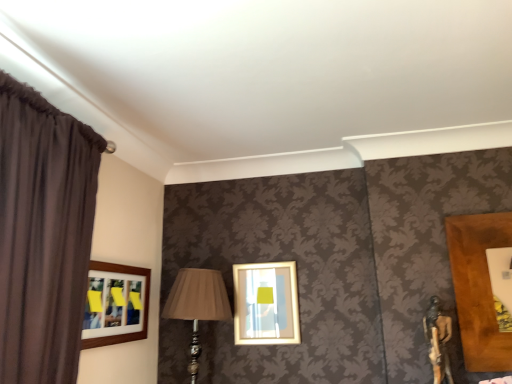
You are a GUI agent. You are given a task and a screenshot of the screen. Output one action in this format:
    pyautogui.click(x=<x>, y=<y>)
    Task: Click on the dark brown fabric curtain at left
    
    Given the screenshot: What is the action you would take?
    pyautogui.click(x=42, y=234)

How much space does wooden-framed picture at left, placed as the second picture frame when sorted from right to left, occupy horizontally?

The width of wooden-framed picture at left, placed as the second picture frame when sorted from right to left, is 1.39 inches.

Locate an element on the screen. wooden-framed picture at left, placed as the second picture frame when sorted from right to left is located at coordinates (115, 304).

Locate an element on the screen. matte gold picture frame at center, which ranks as the 1th picture frame in right-to-left order is located at coordinates (266, 304).

What do you see at coordinates (197, 305) in the screenshot?
I see `matte beige fabric at center` at bounding box center [197, 305].

At what (x,y) coordinates should I click in order to perform the action: click on dark brown fabric curtain at left. Please return your answer as a coordinate pair (x, y). Looking at the image, I should click on (42, 234).

Considering the sizes of objects matte gold picture frame at center, which ranks as the 1th picture frame in right-to-left order, and matte beige fabric at center in the image provided, who is bigger, matte gold picture frame at center, which ranks as the 1th picture frame in right-to-left order, or matte beige fabric at center?

With larger size is matte beige fabric at center.

Does point (294, 299) come closer to viewer compared to point (186, 273)?

That is False.

Is matte gold picture frame at center, arranged as the 2th picture frame when viewed from the left, oriented towards matte beige fabric at center?

No, matte gold picture frame at center, arranged as the 2th picture frame when viewed from the left, is not facing towards matte beige fabric at center.

From the image's perspective, who appears lower, matte gold picture frame at center, arranged as the 2th picture frame when viewed from the left, or matte beige fabric at center?

From the image's view, matte beige fabric at center is below.

Do you think matte beige fabric at center is within matte gold picture frame at center, arranged as the 2th picture frame when viewed from the left, or outside of it?

matte beige fabric at center exists outside the volume of matte gold picture frame at center, arranged as the 2th picture frame when viewed from the left.

Locate an element on the screen. picture frame on the right of matte beige fabric at center is located at coordinates (266, 304).

Measure the distance between matte beige fabric at center and matte gold picture frame at center, arranged as the 2th picture frame when viewed from the left.

matte beige fabric at center is 8.07 inches from matte gold picture frame at center, arranged as the 2th picture frame when viewed from the left.

In order to click on curtain positioned vertically above the wooden-framed picture at left, placed as the second picture frame when sorted from right to left (from a real-world perspective) in this screenshot , I will do `click(42, 234)`.

Does wooden-framed picture at left, placed as the 1th picture frame when sorted from left to right, appear on the left side of dark brown fabric curtain at left?

No, wooden-framed picture at left, placed as the 1th picture frame when sorted from left to right, is not to the left of dark brown fabric curtain at left.

From a real-world perspective, does wooden-framed picture at left, placed as the second picture frame when sorted from right to left, sit lower than dark brown fabric curtain at left?

Yes.

Which is more distant, (118, 319) or (53, 260)?

Point (118, 319)

Considering the sizes of matte beige fabric at center and dark brown fabric curtain at left in the image, is matte beige fabric at center wider or thinner than dark brown fabric curtain at left?

Clearly, matte beige fabric at center has more width compared to dark brown fabric curtain at left.

Would you say matte beige fabric at center is inside or outside dark brown fabric curtain at left?

matte beige fabric at center exists outside the volume of dark brown fabric curtain at left.

The width and height of the screenshot is (512, 384). In order to click on curtain in front of the matte beige fabric at center in this screenshot , I will do `click(42, 234)`.

From a real-world perspective, is dark brown fabric curtain at left physically below matte gold picture frame at center, which ranks as the 1th picture frame in right-to-left order?

Actually, dark brown fabric curtain at left is physically above matte gold picture frame at center, which ranks as the 1th picture frame in right-to-left order, in the real world.

Does point (20, 352) appear closer or farther from the camera than point (283, 320)?

Clearly, point (20, 352) is closer to the camera than point (283, 320).

From the image's perspective, between dark brown fabric curtain at left and matte gold picture frame at center, which ranks as the 1th picture frame in right-to-left order, which one is located above?

dark brown fabric curtain at left.

Considering the sizes of dark brown fabric curtain at left and matte gold picture frame at center, arranged as the 2th picture frame when viewed from the left, in the image, is dark brown fabric curtain at left bigger or smaller than matte gold picture frame at center, arranged as the 2th picture frame when viewed from the left,?

In the image, dark brown fabric curtain at left appears to be larger than matte gold picture frame at center, arranged as the 2th picture frame when viewed from the left.

Does matte gold picture frame at center, arranged as the 2th picture frame when viewed from the left, come behind dark brown fabric curtain at left?

Yes, the depth of matte gold picture frame at center, arranged as the 2th picture frame when viewed from the left, is greater than that of dark brown fabric curtain at left.

Which is more distant, (261,309) or (42,110)?

→ The point (261,309) is farther.

Locate an element on the screen. curtain in front of the matte gold picture frame at center, arranged as the 2th picture frame when viewed from the left is located at coordinates (42, 234).

Considering the positions of objects matte gold picture frame at center, which ranks as the 1th picture frame in right-to-left order, and dark brown fabric curtain at left in the image provided, who is more to the left, matte gold picture frame at center, which ranks as the 1th picture frame in right-to-left order, or dark brown fabric curtain at left?

Positioned to the left is dark brown fabric curtain at left.

Is dark brown fabric curtain at left placed right next to wooden-framed picture at left, placed as the second picture frame when sorted from right to left?

There is a gap between dark brown fabric curtain at left and wooden-framed picture at left, placed as the second picture frame when sorted from right to left.

Is dark brown fabric curtain at left closer to camera compared to wooden-framed picture at left, placed as the second picture frame when sorted from right to left?

Yes, it is in front of wooden-framed picture at left, placed as the second picture frame when sorted from right to left.

From the picture: Can you confirm if dark brown fabric curtain at left is wider than wooden-framed picture at left, placed as the 1th picture frame when sorted from left to right?

Indeed, dark brown fabric curtain at left has a greater width compared to wooden-framed picture at left, placed as the 1th picture frame when sorted from left to right.

Where is `table lamp on the left of matte gold picture frame at center, which ranks as the 1th picture frame in right-to-left order`? The height and width of the screenshot is (384, 512). table lamp on the left of matte gold picture frame at center, which ranks as the 1th picture frame in right-to-left order is located at coordinates (197, 305).

From a real-world perspective, starting from the matte beige fabric at center, which picture frame is the 1st one vertically above it? Please provide its 2D coordinates.

[(266, 304)]

Based on their spatial positions, is matte beige fabric at center or dark brown fabric curtain at left further from matte gold picture frame at center, which ranks as the 1th picture frame in right-to-left order?

dark brown fabric curtain at left is positioned further to the anchor matte gold picture frame at center, which ranks as the 1th picture frame in right-to-left order.

Which object lies nearer to the anchor point dark brown fabric curtain at left, matte beige fabric at center or matte gold picture frame at center, arranged as the 2th picture frame when viewed from the left?

matte beige fabric at center is positioned closer to the anchor dark brown fabric curtain at left.

Estimate the real-world distances between objects in this image. Which object is closer to dark brown fabric curtain at left, matte gold picture frame at center, which ranks as the 1th picture frame in right-to-left order, or matte beige fabric at center?

matte beige fabric at center is positioned closer to the anchor dark brown fabric curtain at left.

Based on their spatial positions, is wooden-framed picture at left, placed as the 1th picture frame when sorted from left to right, or dark brown fabric curtain at left further from matte beige fabric at center?

dark brown fabric curtain at left is further to matte beige fabric at center.

Which object lies further to the anchor point matte beige fabric at center, wooden-framed picture at left, placed as the second picture frame when sorted from right to left, or matte gold picture frame at center, arranged as the 2th picture frame when viewed from the left?

wooden-framed picture at left, placed as the second picture frame when sorted from right to left.

Considering their positions, is matte beige fabric at center positioned closer to wooden-framed picture at left, placed as the 1th picture frame when sorted from left to right, than matte gold picture frame at center, arranged as the 2th picture frame when viewed from the left?

Based on the image, matte beige fabric at center appears to be nearer to wooden-framed picture at left, placed as the 1th picture frame when sorted from left to right.

When comparing their distances from wooden-framed picture at left, placed as the second picture frame when sorted from right to left, does matte gold picture frame at center, which ranks as the 1th picture frame in right-to-left order, or dark brown fabric curtain at left seem further?

matte gold picture frame at center, which ranks as the 1th picture frame in right-to-left order.

Based on their spatial positions, is wooden-framed picture at left, placed as the 1th picture frame when sorted from left to right, or dark brown fabric curtain at left further from matte gold picture frame at center, arranged as the 2th picture frame when viewed from the left?

Among the two, dark brown fabric curtain at left is located further to matte gold picture frame at center, arranged as the 2th picture frame when viewed from the left.

Identify the location of table lamp between dark brown fabric curtain at left and matte gold picture frame at center, which ranks as the 1th picture frame in right-to-left order, from front to back. (197, 305).

This screenshot has width=512, height=384. What are the coordinates of `picture frame between dark brown fabric curtain at left and matte gold picture frame at center, which ranks as the 1th picture frame in right-to-left order, along the z-axis` in the screenshot? It's located at (115, 304).

The height and width of the screenshot is (384, 512). Identify the location of picture frame positioned between dark brown fabric curtain at left and matte beige fabric at center from near to far. (115, 304).

Where is `table lamp between wooden-framed picture at left, placed as the 1th picture frame when sorted from left to right, and matte gold picture frame at center, which ranks as the 1th picture frame in right-to-left order`? This screenshot has height=384, width=512. table lamp between wooden-framed picture at left, placed as the 1th picture frame when sorted from left to right, and matte gold picture frame at center, which ranks as the 1th picture frame in right-to-left order is located at coordinates (197, 305).